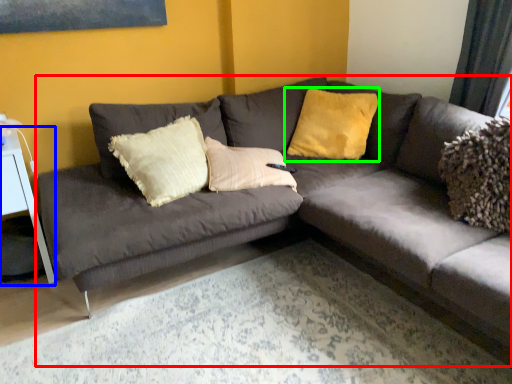
Question: Estimate the real-world distances between objects in this image. Which object is farther from studio couch (highlighted by a red box), table (highlighted by a blue box) or pillow (highlighted by a green box)?

Choices:
 (A) table
 (B) pillow

Answer: (A)